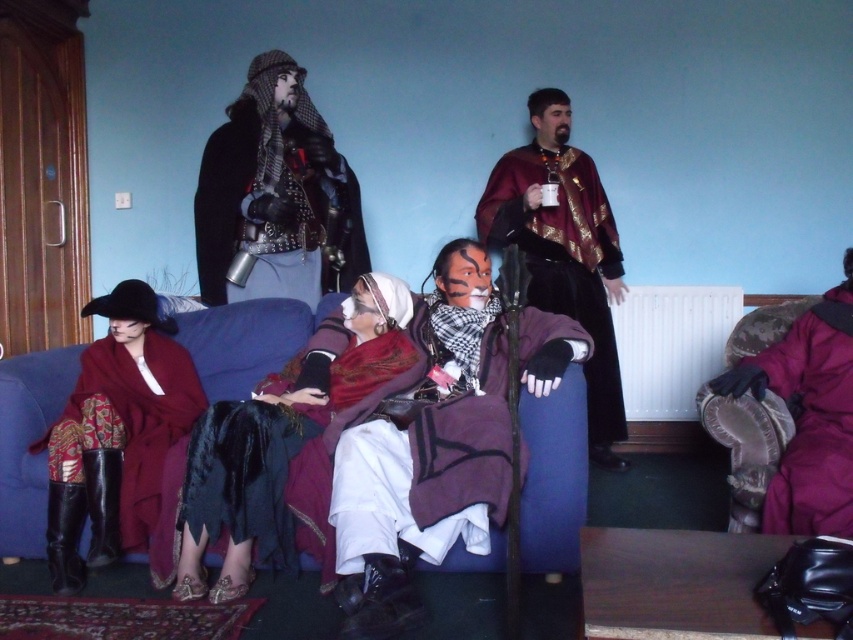
Does point (567, 371) come in front of point (509, 196)?

Yes, point (567, 371) is in front of point (509, 196).

Between point (44, 509) and point (612, 225), which one is positioned behind?

The point (612, 225) is behind.

Where is `blue fabric couch at center`? blue fabric couch at center is located at coordinates (553, 476).

Which is more to the left, matte black mask at center or velvet maroon coat at lower left?

From the viewer's perspective, velvet maroon coat at lower left appears more on the left side.

Is point (512, 456) less distant than point (117, 451)?

Yes.

Describe the element at coordinates (445, 442) in the screenshot. I see `matte black mask at center` at that location.

Locate an element on the screen. The width and height of the screenshot is (853, 640). matte black mask at center is located at coordinates (445, 442).

Does velvet maroon cape at center appear under purple matte helmet at right?

No.

Does velvet maroon cape at center have a smaller size compared to purple matte helmet at right?

No, velvet maroon cape at center is not smaller than purple matte helmet at right.

At what (x,y) coordinates should I click in order to perform the action: click on velvet maroon cape at center. Please return your answer as a coordinate pair (x, y). The width and height of the screenshot is (853, 640). Looking at the image, I should click on (564, 250).